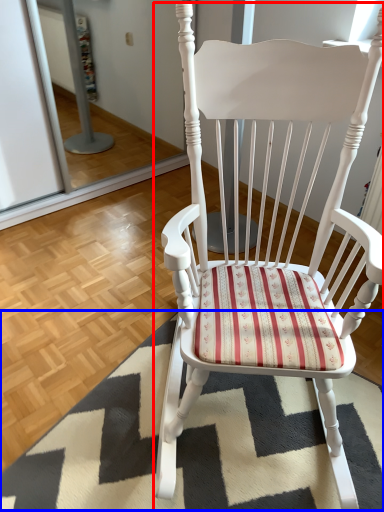
Question: Which point is further to the camera, chair (highlighted by a red box) or doormat (highlighted by a blue box)?

Choices:
 (A) chair
 (B) doormat

Answer: (B)